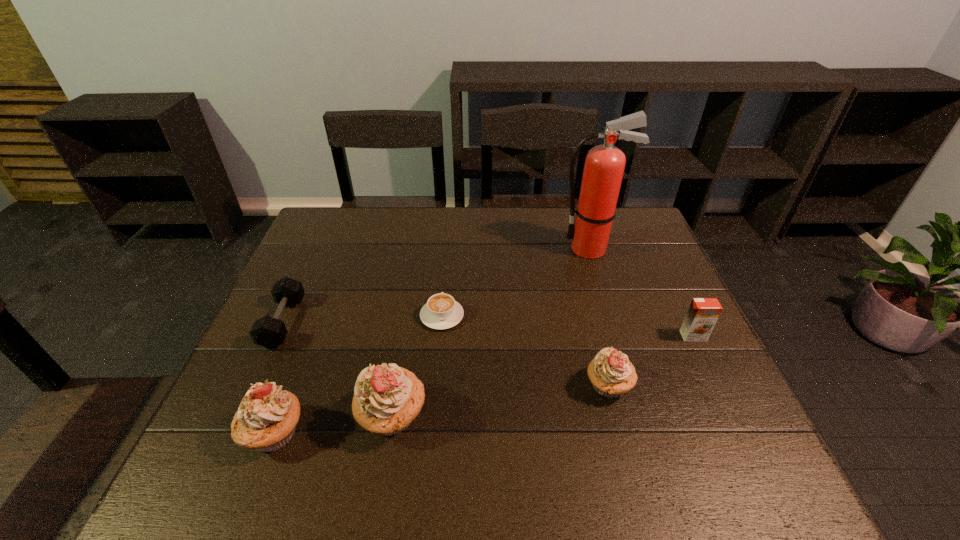
The width and height of the screenshot is (960, 540). Identify the location of vacant space situated on the back of the second cupcake from right to left. (410, 310).

Find the location of `vacant space located on the left of the rightmost cupcake`. vacant space located on the left of the rightmost cupcake is located at coordinates (414, 386).

I want to click on free space located on the hose direction of the fire extinguisher, so click(514, 249).

Identify the location of free point located 0.380m on the hose direction of the fire extinguisher. The height and width of the screenshot is (540, 960). (438, 249).

You are a GUI agent. You are given a task and a screenshot of the screen. Output one action in this format:
    pyautogui.click(x=<x>, y=<y>)
    Task: Click on the vacant space situated 0.110m on the hose direction of the fire extinguisher
    Image resolution: width=960 pixels, height=540 pixels.
    Given the screenshot: What is the action you would take?
    pyautogui.click(x=523, y=249)

Identify the location of vacant space located on the front of the rightmost object. (711, 374).

I want to click on vacant space located on the front of the dumbbell, so click(236, 425).

Locate an element on the screen. The image size is (960, 540). vacant space located 0.070m on the side of the shortest object with the handle is located at coordinates (444, 284).

Locate an element on the screen. The height and width of the screenshot is (540, 960). vacant space located on the side of the shortest object with the handle is located at coordinates (449, 239).

Find the location of a particular element. vacant space situated 0.310m on the side of the shortest object with the handle is located at coordinates (449, 235).